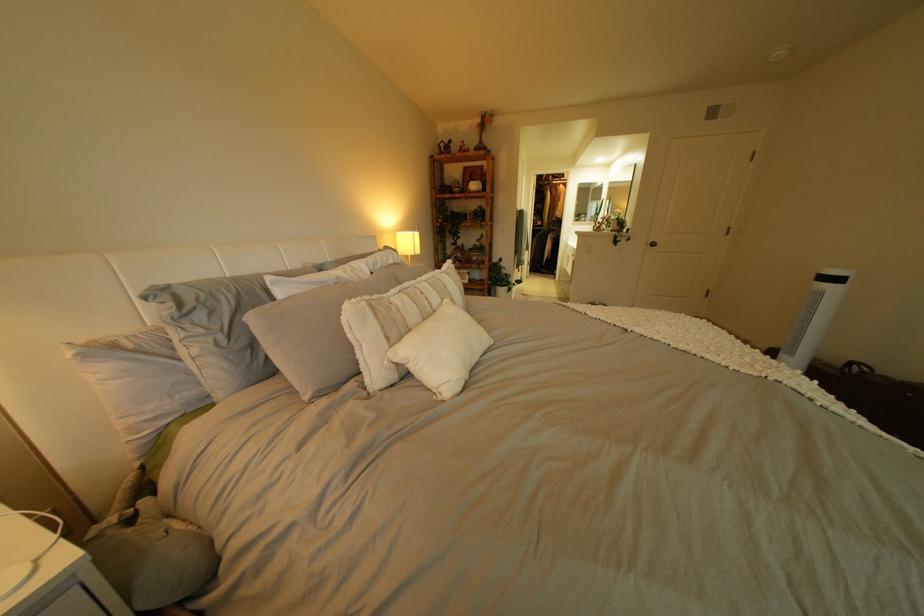
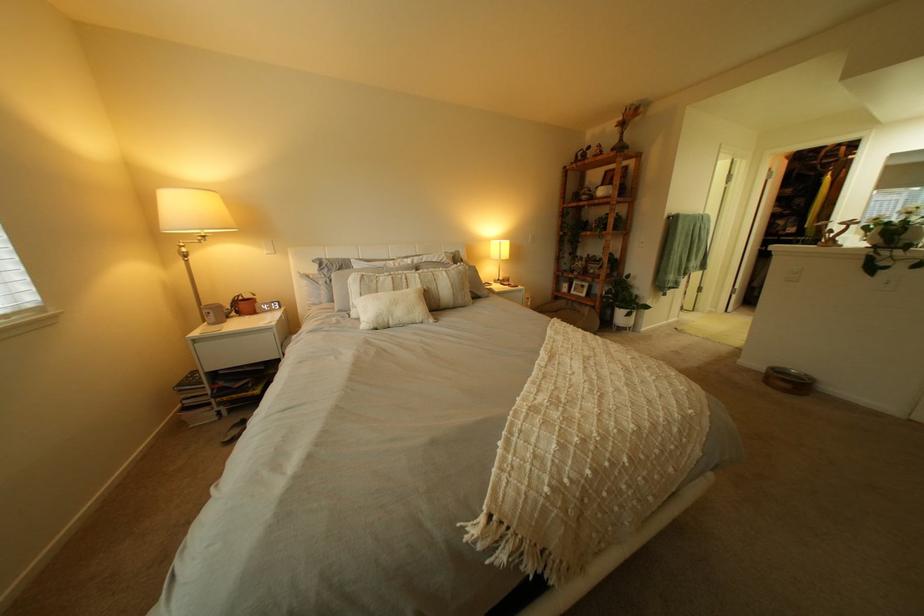
Locate, in the second image, the point that corresponds to point (451, 294) in the first image.

(434, 283)